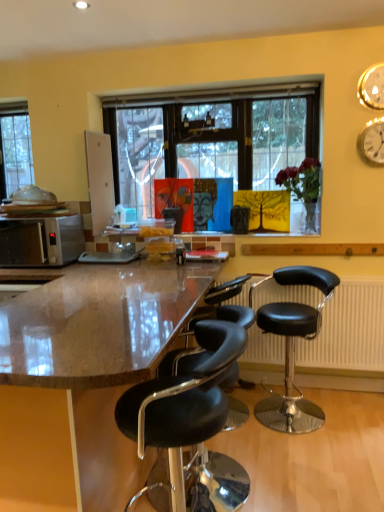
The image size is (384, 512). Identify the location of brown polished granite countertop at center. (99, 323).

The height and width of the screenshot is (512, 384). What do you see at coordinates (175, 199) in the screenshot?
I see `matte orange portrait at center, placed as the 1th person when sorted from left to right` at bounding box center [175, 199].

Find the location of a particular element. brown polished granite countertop at center is located at coordinates (99, 323).

Can you confirm if black leather stool at right, acting as the 2th chair starting from the left, is thinner than gold metallic clock at upper right, which is counted as the 1th clock, starting from the top?

Incorrect, the width of black leather stool at right, acting as the 2th chair starting from the left, is not less than that of gold metallic clock at upper right, which is counted as the 1th clock, starting from the top.

Is black leather stool at right, the second chair in the front-to-back sequence, at the right side of gold metallic clock at upper right, the 2th clock in the bottom-to-top sequence?

In fact, black leather stool at right, the second chair in the front-to-back sequence, is to the left of gold metallic clock at upper right, the 2th clock in the bottom-to-top sequence.

Considering the points (312, 308) and (366, 98), which point is behind, point (312, 308) or point (366, 98)?

The point (312, 308) is farther.

Which is more to the right, translucent glass vase at upper center or clear glass window at left?

From the viewer's perspective, translucent glass vase at upper center appears more on the right side.

Does translucent glass vase at upper center lie behind clear glass window at left?

No.

Is translucent glass vase at upper center looking in the opposite direction of clear glass window at left?

translucent glass vase at upper center is not turned away from clear glass window at left.

Is brown polished granite countertop at center inside satin silver microwave at left?

No, brown polished granite countertop at center is not inside satin silver microwave at left.

Could you tell me if satin silver microwave at left is facing brown polished granite countertop at center?

No, satin silver microwave at left is not oriented towards brown polished granite countertop at center.

In the image, there is a satin silver microwave at left. At what (x,y) coordinates should I click in order to perform the action: click on countertop below it (from the image's perspective). Please return your answer as a coordinate pair (x, y). Looking at the image, I should click on (99, 323).

Is satin silver microwave at left not close to brown polished granite countertop at center?

satin silver microwave at left is near brown polished granite countertop at center, not far away.

In the scene shown: Can you confirm if black leather stool at center, which is the first chair in front-to-back order, is positioned to the right of gold metallic clock at upper right, the 2th clock in the bottom-to-top sequence?

Incorrect, black leather stool at center, which is the first chair in front-to-back order, is not on the right side of gold metallic clock at upper right, the 2th clock in the bottom-to-top sequence.

Is black leather stool at center, which is the first chair in front-to-back order, taller than gold metallic clock at upper right, which is counted as the 1th clock, starting from the top?

Yes, black leather stool at center, which is the first chair in front-to-back order, is taller than gold metallic clock at upper right, which is counted as the 1th clock, starting from the top.

Could you measure the distance between black leather stool at center, which is the first chair in front-to-back order, and gold metallic clock at upper right, which is counted as the 1th clock, starting from the top?

A distance of 6.53 feet exists between black leather stool at center, which is the first chair in front-to-back order, and gold metallic clock at upper right, which is counted as the 1th clock, starting from the top.

Is black leather stool at center, the 2th chair when ordered from back to front, wider than gold metallic clock at upper right, the 2th clock in the bottom-to-top sequence?

Yes, black leather stool at center, the 2th chair when ordered from back to front, is wider than gold metallic clock at upper right, the 2th clock in the bottom-to-top sequence.

Considering the positions of objects satin silver microwave at left and black leather stool at center, which appears as the first chair when viewed from the left, in the image provided, who is more to the right, satin silver microwave at left or black leather stool at center, which appears as the first chair when viewed from the left,?

black leather stool at center, which appears as the first chair when viewed from the left, is more to the right.

Is black leather stool at center, which appears as the first chair when viewed from the left, located within satin silver microwave at left?

Definitely not — black leather stool at center, which appears as the first chair when viewed from the left, is not inside satin silver microwave at left.

Which of these two, satin silver microwave at left or black leather stool at center, which ranks as the 2th chair in right-to-left order, is thinner?

satin silver microwave at left is thinner.

From the image's perspective, relative to gold metallic clock at upper right, which appears as the 2th clock when viewed from the top, is matte orange portrait at center, arranged as the second person when viewed from the right, above or below?

matte orange portrait at center, arranged as the second person when viewed from the right, is situated lower than gold metallic clock at upper right, which appears as the 2th clock when viewed from the top, in the image.

Is matte orange portrait at center, placed as the 1th person when sorted from left to right, oriented away from gold metallic clock at upper right, which appears as the 2th clock when viewed from the top?

No, matte orange portrait at center, placed as the 1th person when sorted from left to right, is not facing the opposite direction of gold metallic clock at upper right, which appears as the 2th clock when viewed from the top.

Considering the points (165, 196) and (367, 129), which point is in front, point (165, 196) or point (367, 129)?

The point (367, 129) is more forward.

Considering the sizes of objects matte orange portrait at center, arranged as the second person when viewed from the right, and gold metallic clock at upper right, which ranks as the first clock in bottom-to-top order, in the image provided, who is taller, matte orange portrait at center, arranged as the second person when viewed from the right, or gold metallic clock at upper right, which ranks as the first clock in bottom-to-top order,?

matte orange portrait at center, arranged as the second person when viewed from the right.

Does point (200, 342) come in front of point (155, 304)?

That is True.

From a real-world perspective, is black leather stool at center, which ranks as the 2th chair in right-to-left order, positioned over brown polished granite countertop at center based on gravity?

No, from a real-world perspective, black leather stool at center, which ranks as the 2th chair in right-to-left order, is not above brown polished granite countertop at center.

In the image, is black leather stool at center, the 2th chair when ordered from back to front, positioned in front of or behind brown polished granite countertop at center?

Clearly, black leather stool at center, the 2th chair when ordered from back to front, is behind brown polished granite countertop at center.

Starting from the gold metallic clock at upper right, the 2th clock in the bottom-to-top sequence, which chair is the 1st one in front? Please provide its 2D coordinates.

[(293, 347)]

Identify the location of flower located below the clear glass window at left (from the image's perspective). (301, 179).

Considering their positions, is gold metallic clock at upper right, the 2th clock in the bottom-to-top sequence, positioned further to black plastic radiator at lower right than gold metallic clock at upper right, which appears as the 2th clock when viewed from the top?

gold metallic clock at upper right, the 2th clock in the bottom-to-top sequence.

Based on their spatial positions, is clear glass window at left or black leather stool at center, which ranks as the 2th chair in right-to-left order, further from gold metallic clock at upper right, which is counted as the 1th clock, starting from the top?

clear glass window at left is further to gold metallic clock at upper right, which is counted as the 1th clock, starting from the top.

Considering their positions, is blue textured canvas at center, which is the 1th person in right-to-left order, positioned closer to translucent glass vase at upper center than black leather stool at right, the second chair in the front-to-back sequence?

Based on the image, blue textured canvas at center, which is the 1th person in right-to-left order, appears to be nearer to translucent glass vase at upper center.

Looking at the image, which one is located closer to black leather stool at right, the 1th chair when ordered from back to front, matte orange portrait at center, placed as the 1th person when sorted from left to right, or black leather stool at center, which ranks as the 2th chair in right-to-left order?

matte orange portrait at center, placed as the 1th person when sorted from left to right.

From the image, which object appears to be farther from gold metallic clock at upper right, the 2th clock in the bottom-to-top sequence, translucent glass vase at upper center or gold metallic clock at upper right, which appears as the 2th clock when viewed from the top?

translucent glass vase at upper center is positioned further to the anchor gold metallic clock at upper right, the 2th clock in the bottom-to-top sequence.

From the image, which object appears to be farther from gold metallic clock at upper right, which is counted as the 1th clock, starting from the top, matte orange portrait at center, arranged as the second person when viewed from the right, or black leather stool at center, which ranks as the 2th chair in right-to-left order?

black leather stool at center, which ranks as the 2th chair in right-to-left order, lies further to gold metallic clock at upper right, which is counted as the 1th clock, starting from the top, than the other object.

Which object lies nearer to the anchor point gold metallic clock at upper right, which is counted as the 1th clock, starting from the top, gold metallic clock at upper right, which appears as the 2th clock when viewed from the top, or matte orange portrait at center, placed as the 1th person when sorted from left to right?

gold metallic clock at upper right, which appears as the 2th clock when viewed from the top, lies closer to gold metallic clock at upper right, which is counted as the 1th clock, starting from the top, than the other object.

Estimate the real-world distances between objects in this image. Which object is closer to black leather stool at right, the second chair in the front-to-back sequence, translucent glass vase at upper center or clear glass window at left?

Among the two, translucent glass vase at upper center is located nearer to black leather stool at right, the second chair in the front-to-back sequence.

The width and height of the screenshot is (384, 512). Identify the location of radiator located between satin silver microwave at left and gold metallic clock at upper right, which appears as the 2th clock when viewed from the top, in the left-right direction. (348, 330).

Locate an element on the screen. radiator between satin silver microwave at left and gold metallic clock at upper right, which is counted as the 1th clock, starting from the top, in the horizontal direction is located at coordinates click(x=348, y=330).

Where is `clock that lies between gold metallic clock at upper right, which is counted as the 1th clock, starting from the top, and translucent glass vase at upper center from top to bottom`? clock that lies between gold metallic clock at upper right, which is counted as the 1th clock, starting from the top, and translucent glass vase at upper center from top to bottom is located at coordinates (372, 141).

The width and height of the screenshot is (384, 512). I want to click on flower positioned between black leather stool at center, which is the first chair in front-to-back order, and blue textured canvas at center, positioned as the second person in left-to-right order, from near to far, so click(301, 179).